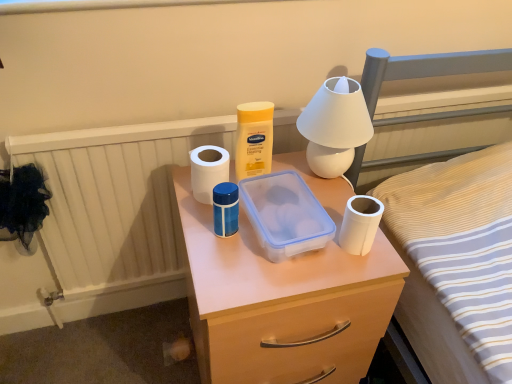
You are a GUI agent. You are given a task and a screenshot of the screen. Output one action in this format:
    pyautogui.click(x=<x>, y=<y>)
    Task: Click on the blank area to the left of white matte toilet paper at right, the second toilet paper in the back-to-front sequence
    This screenshot has width=512, height=384.
    Given the screenshot: What is the action you would take?
    pyautogui.click(x=279, y=268)